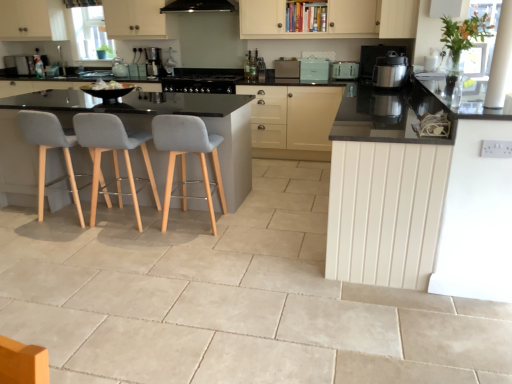
Question: Does white wood counter at right have a greater height compared to matte teal toaster at center, arranged as the second appliance when viewed from the left?

Choices:
 (A) yes
 (B) no

Answer: (A)

Question: Can we say white wood counter at right lies outside matte teal toaster at center, arranged as the second appliance when viewed from the left?

Choices:
 (A) yes
 (B) no

Answer: (A)

Question: Considering the relative positions of white wood counter at right and matte teal toaster at center, arranged as the second appliance when viewed from the left, in the image provided, is white wood counter at right in front of matte teal toaster at center, arranged as the second appliance when viewed from the left,?

Choices:
 (A) yes
 (B) no

Answer: (A)

Question: Considering the relative sizes of white wood counter at right and matte teal toaster at center, which appears as the 2th appliance when viewed from the right, in the image provided, is white wood counter at right bigger than matte teal toaster at center, which appears as the 2th appliance when viewed from the right,?

Choices:
 (A) no
 (B) yes

Answer: (B)

Question: Is white wood counter at right thinner than matte teal toaster at center, arranged as the second appliance when viewed from the left?

Choices:
 (A) yes
 (B) no

Answer: (B)

Question: From a real-world perspective, is white wood counter at right below matte teal toaster at center, arranged as the second appliance when viewed from the left?

Choices:
 (A) no
 (B) yes

Answer: (B)

Question: Is the depth of matte black cabinet at center, the 1th cabinetry when ordered from back to front, less than that of matte white cabinet at upper right, which ranks as the 1th cabinetry in front-to-back order?

Choices:
 (A) no
 (B) yes

Answer: (A)

Question: Is matte black cabinet at center, the second cabinetry viewed from the front, smaller than matte white cabinet at upper right, which ranks as the 1th cabinetry in front-to-back order?

Choices:
 (A) yes
 (B) no

Answer: (B)

Question: From the image's perspective, does matte black cabinet at center, the second cabinetry viewed from the front, appear higher than matte white cabinet at upper right, which ranks as the 1th cabinetry in front-to-back order?

Choices:
 (A) no
 (B) yes

Answer: (A)

Question: Does matte black cabinet at center, placed as the second cabinetry when sorted from top to bottom, have a greater width compared to matte white cabinet at upper right, which ranks as the 1th cabinetry in front-to-back order?

Choices:
 (A) yes
 (B) no

Answer: (A)

Question: Does matte black cabinet at center, placed as the second cabinetry when sorted from top to bottom, turn towards matte white cabinet at upper right, which is the 2th cabinetry from bottom to top?

Choices:
 (A) yes
 (B) no

Answer: (B)

Question: Are matte black cabinet at center, the 1th cabinetry when ordered from back to front, and matte white cabinet at upper right, which is the 2th cabinetry from bottom to top, far apart?

Choices:
 (A) yes
 (B) no

Answer: (A)

Question: From a real-world perspective, is light gray fabric chair at left, the 2th chair viewed from the right, below white wood counter at right?

Choices:
 (A) no
 (B) yes

Answer: (B)